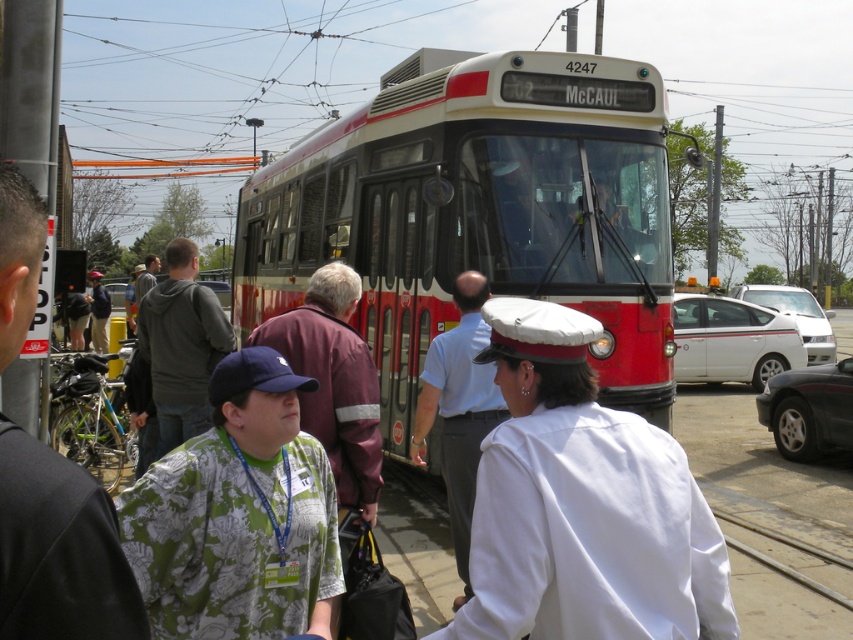
You are a passenger at the tram stop and want to board the tram. You notice the red polished metal bus at center and the white cotton cap at center. How far apart are these two items?

The red polished metal bus at center and the white cotton cap at center are 16.09 feet apart.

You are standing at the tram stop and see two points marked on the ground. The first point is at coordinate point(x=517, y=340) and the second point is at coordinate point(x=215, y=602). Which point is closer to you?

The point at coordinate point(x=517, y=340) is closer to you than the point at coordinate point(x=215, y=602).

You are a photographer standing at the tram stop. You want to take a photo of the green printed shirt at center and the dark gray hoodie at center. Which clothing item will appear smaller in the photo?

The green printed shirt at center will appear smaller in the photo because it has a lesser height compared to the dark gray hoodie at center.